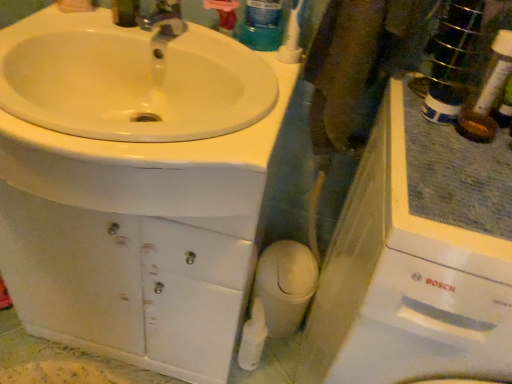
Question: Does translucent plastic mouthwash at upper center have a lesser width compared to white plastic toothbrush at upper right?

Choices:
 (A) no
 (B) yes

Answer: (A)

Question: Is translucent plastic mouthwash at upper center looking in the opposite direction of white plastic toothbrush at upper right?

Choices:
 (A) yes
 (B) no

Answer: (B)

Question: From a real-world perspective, is translucent plastic mouthwash at upper center over white plastic toothbrush at upper right?

Choices:
 (A) yes
 (B) no

Answer: (A)

Question: Is the surface of translucent plastic mouthwash at upper center in direct contact with white plastic toothbrush at upper right?

Choices:
 (A) no
 (B) yes

Answer: (B)

Question: Would you say white plastic toothbrush at upper right is part of translucent plastic mouthwash at upper center's contents?

Choices:
 (A) yes
 (B) no

Answer: (B)

Question: Is translucent plastic mouthwash at upper center closer to camera compared to white plastic toothbrush at upper right?

Choices:
 (A) yes
 (B) no

Answer: (B)

Question: From a real-world perspective, is translucent plastic mouthwash at upper center physically below white glossy sink at upper left?

Choices:
 (A) no
 (B) yes

Answer: (A)

Question: Considering the relative sizes of translucent plastic mouthwash at upper center and white glossy sink at upper left in the image provided, is translucent plastic mouthwash at upper center bigger than white glossy sink at upper left?

Choices:
 (A) no
 (B) yes

Answer: (A)

Question: Is translucent plastic mouthwash at upper center outside of white glossy sink at upper left?

Choices:
 (A) yes
 (B) no

Answer: (A)

Question: Considering the relative sizes of translucent plastic mouthwash at upper center and white glossy sink at upper left in the image provided, is translucent plastic mouthwash at upper center thinner than white glossy sink at upper left?

Choices:
 (A) yes
 (B) no

Answer: (A)

Question: Is translucent plastic mouthwash at upper center directly adjacent to white glossy sink at upper left?

Choices:
 (A) yes
 (B) no

Answer: (B)

Question: Does translucent plastic mouthwash at upper center have a greater width compared to white glossy sink at upper left?

Choices:
 (A) no
 (B) yes

Answer: (A)

Question: Can you confirm if white glossy sink at upper left is positioned to the right of white plastic toothbrush at upper right?

Choices:
 (A) no
 (B) yes

Answer: (A)